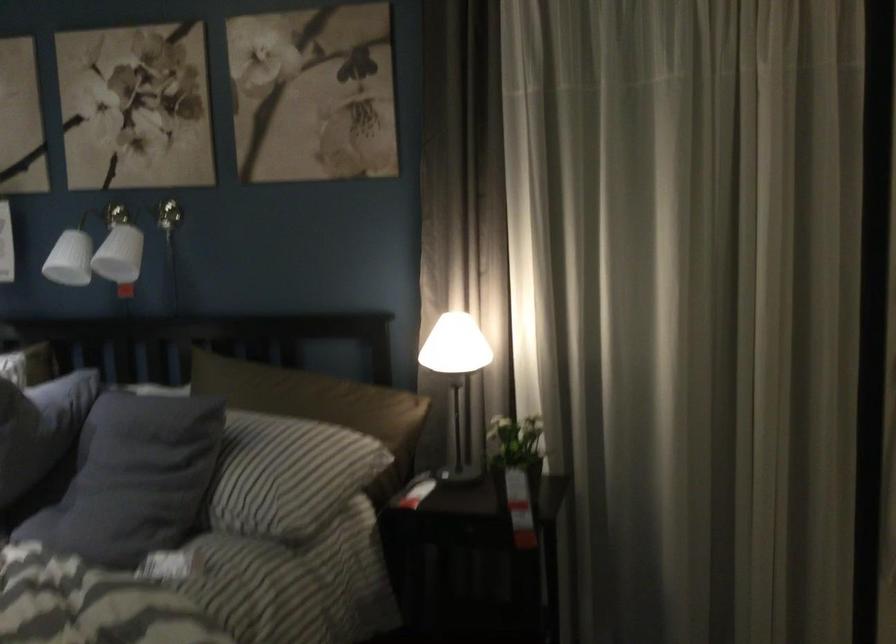
Identify the location of white curtain edge. pyautogui.click(x=761, y=540).